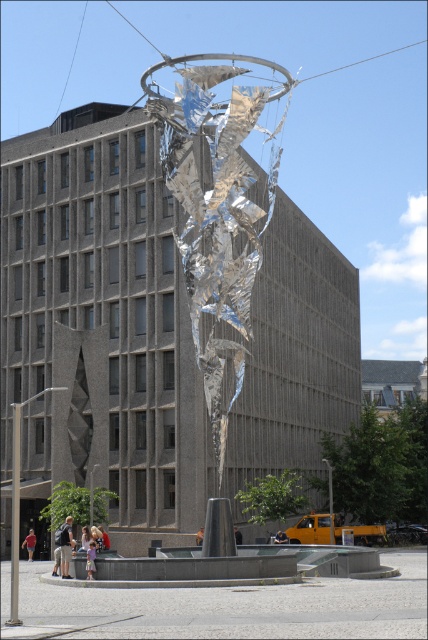
Question: Does light brown leather jacket at lower left appear over light brown leather jacket at center?

Choices:
 (A) no
 (B) yes

Answer: (B)

Question: Which point is farther to the camera?

Choices:
 (A) (104, 547)
 (B) (83, 541)

Answer: (A)

Question: Estimate the real-world distances between objects in this image. Which object is closer to the shiny metallic sculpture at center?

Choices:
 (A) red fabric person at lower left
 (B) light brown hair at center
 (C) dark brown leather jacket at center
 (D) light brown leather jacket at center

Answer: (C)

Question: Can you confirm if red fabric person at lower left is positioned below dark brown leather jacket at center?

Choices:
 (A) no
 (B) yes

Answer: (B)

Question: Is blonde hair person at center below orange fabric person at center?

Choices:
 (A) yes
 (B) no

Answer: (B)

Question: Which object appears farthest from the camera in this image?

Choices:
 (A) red fabric person at lower left
 (B) light purple cotton dress at lower center

Answer: (A)